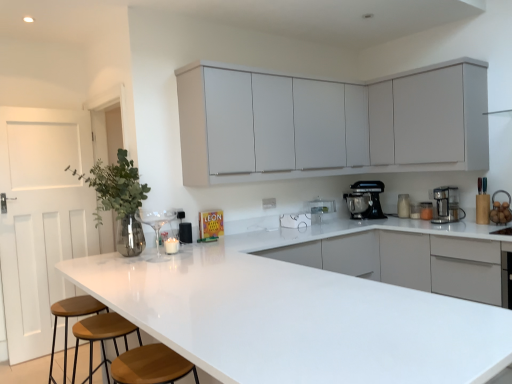
Measure the distance between white matte cabinet at upper right, the 2th cabinetry viewed from the left, and camera.

They are 10.33 feet apart.

This screenshot has height=384, width=512. What do you see at coordinates (297, 315) in the screenshot? I see `white glossy countertop at center` at bounding box center [297, 315].

In order to face brown leather stool at lower left, which is counted as the first bar stool, starting from the back, should I rotate leftwards or rightwards?

You should look left and rotate roughly 21.899 degrees.

Locate an element on the screen. Image resolution: width=512 pixels, height=384 pixels. white matte cabinet at upper center, which ranks as the 1th cabinetry in left-to-right order is located at coordinates (329, 123).

Locate an element on the screen. This screenshot has width=512, height=384. white glossy milk bottle at right, which appears as the first appliance when viewed from the left is located at coordinates (403, 206).

Describe the element at coordinates (403, 206) in the screenshot. I see `white glossy milk bottle at right, which is the 2th appliance in right-to-left order` at that location.

In order to click on silver metallic vase at left in this screenshot , I will do `click(120, 198)`.

Describe the element at coordinates (120, 198) in the screenshot. I see `silver metallic vase at left` at that location.

What do you see at coordinates (446, 206) in the screenshot?
I see `metallic silver coffee maker at right, which is the second home appliance from back to front` at bounding box center [446, 206].

At what (x,y) coordinates should I click in order to perform the action: click on white matte cabinet at upper right, the first cabinetry viewed from the right. Please return your answer as a coordinate pair (x, y). This screenshot has height=384, width=512. Looking at the image, I should click on (441, 116).

From the image's perspective, is metallic silver coffee maker at right, which is the second home appliance from back to front, under brown leather stool at lower left, which is counted as the first bar stool, starting from the back?

No, from the image's perspective, metallic silver coffee maker at right, which is the second home appliance from back to front, is not below brown leather stool at lower left, which is counted as the first bar stool, starting from the back.

Where is `bar stool that is the 2nd object located below the metallic silver coffee maker at right, the 1th home appliance when ordered from right to left (from the image's perspective)`? The width and height of the screenshot is (512, 384). bar stool that is the 2nd object located below the metallic silver coffee maker at right, the 1th home appliance when ordered from right to left (from the image's perspective) is located at coordinates (72, 316).

Consider the image. Considering the relative sizes of metallic silver coffee maker at right, the 1th home appliance when ordered from right to left, and brown leather stool at lower left, acting as the 2th bar stool starting from the front, in the image provided, is metallic silver coffee maker at right, the 1th home appliance when ordered from right to left, bigger than brown leather stool at lower left, acting as the 2th bar stool starting from the front,?

No, metallic silver coffee maker at right, the 1th home appliance when ordered from right to left, is not bigger than brown leather stool at lower left, acting as the 2th bar stool starting from the front.

Considering the relative sizes of metallic silver coffee maker at right, which is the second home appliance in left-to-right order, and brown leather stool at lower left, acting as the 2th bar stool starting from the front, in the image provided, is metallic silver coffee maker at right, which is the second home appliance in left-to-right order, wider than brown leather stool at lower left, acting as the 2th bar stool starting from the front,?

Incorrect, the width of metallic silver coffee maker at right, which is the second home appliance in left-to-right order, does not surpass that of brown leather stool at lower left, acting as the 2th bar stool starting from the front.

In terms of size, does white glossy countertop at center appear bigger or smaller than silver metallic vase at left?

white glossy countertop at center is bigger than silver metallic vase at left.

Does point (328, 334) come closer to viewer compared to point (117, 195)?

Yes, point (328, 334) is closer to viewer.

Between white glossy countertop at center and silver metallic vase at left, which one is positioned in front?

white glossy countertop at center is in front.

From the image's perspective, who appears lower, white glossy countertop at center or silver metallic vase at left?

white glossy countertop at center is shown below in the image.

Is white glossy milk bottle at right, the 2th appliance viewed from the front, completely or partially outside of brown wooden stool at lower left, the 1th bar stool positioned from the front?

Yes.

From a real-world perspective, is white glossy milk bottle at right, which is the 2th appliance in right-to-left order, positioned under brown wooden stool at lower left, positioned as the second bar stool in back-to-front order, based on gravity?

No, from a real-world perspective, white glossy milk bottle at right, which is the 2th appliance in right-to-left order, is not under brown wooden stool at lower left, positioned as the second bar stool in back-to-front order.

Is black matte stand mixer at right, arranged as the second home appliance when viewed from the front, taller or shorter than white glossy countertop at center?

Clearly, black matte stand mixer at right, arranged as the second home appliance when viewed from the front, is shorter compared to white glossy countertop at center.

Measure the distance between black matte stand mixer at right, which ranks as the second home appliance in right-to-left order, and white glossy countertop at center.

black matte stand mixer at right, which ranks as the second home appliance in right-to-left order, and white glossy countertop at center are 6.94 feet apart from each other.

Does black matte stand mixer at right, arranged as the second home appliance when viewed from the front, contain white glossy countertop at center?

No, white glossy countertop at center is not a part of black matte stand mixer at right, arranged as the second home appliance when viewed from the front.

Does black matte stand mixer at right, which is the 1th home appliance from back to front, turn towards white glossy countertop at center?

No, black matte stand mixer at right, which is the 1th home appliance from back to front, is not aimed at white glossy countertop at center.

From the image's perspective, which home appliance is the 2nd one above the white glossy milk bottle at right, which is the 2th appliance in right-to-left order? Please provide its 2D coordinates.

[(365, 200)]

Does black matte stand mixer at right, which ranks as the second home appliance in right-to-left order, have a lesser height compared to white glossy milk bottle at right, the first appliance in the back-to-front sequence?

In fact, black matte stand mixer at right, which ranks as the second home appliance in right-to-left order, may be taller than white glossy milk bottle at right, the first appliance in the back-to-front sequence.

Is point (366, 196) more distant than point (397, 203)?

No, it is in front of (397, 203).

In terms of width, does white glossy milk bottle at right, which appears as the first appliance when viewed from the left, look wider or thinner when compared to matte black coffee maker at right, the first appliance when ordered from right to left?

Considering their sizes, white glossy milk bottle at right, which appears as the first appliance when viewed from the left, looks broader than matte black coffee maker at right, the first appliance when ordered from right to left.

Is white glossy milk bottle at right, which appears as the first appliance when viewed from the left, taller than matte black coffee maker at right, which ranks as the first appliance in front-to-back order?

Yes, white glossy milk bottle at right, which appears as the first appliance when viewed from the left, is taller than matte black coffee maker at right, which ranks as the first appliance in front-to-back order.

From the image's perspective, is white glossy milk bottle at right, the 2th appliance viewed from the front, on matte black coffee maker at right, which ranks as the second appliance in back-to-front order?

Yes.

Is white glossy milk bottle at right, which is the 2th appliance in right-to-left order, beside matte black coffee maker at right, the first appliance when ordered from right to left?

No.

Considering the sizes of black matte stand mixer at right, placed as the 1th home appliance when sorted from left to right, and brown leather stool at lower left, which is counted as the first bar stool, starting from the back, in the image, is black matte stand mixer at right, placed as the 1th home appliance when sorted from left to right, taller or shorter than brown leather stool at lower left, which is counted as the first bar stool, starting from the back,?

Considering their sizes, black matte stand mixer at right, placed as the 1th home appliance when sorted from left to right, has less height than brown leather stool at lower left, which is counted as the first bar stool, starting from the back.

Is point (371, 212) positioned in front of point (67, 333)?

No.

From the image's perspective, which one is positioned higher, black matte stand mixer at right, which ranks as the second home appliance in right-to-left order, or brown leather stool at lower left, which is counted as the first bar stool, starting from the back?

black matte stand mixer at right, which ranks as the second home appliance in right-to-left order, appears higher in the image.

Identify the location of home appliance that is the 1st object located behind the brown leather stool at lower left, acting as the 2th bar stool starting from the front. (446, 206).

The width and height of the screenshot is (512, 384). I want to click on countertop on the right of silver metallic vase at left, so click(297, 315).

Looking at the image, which one is located closer to matte black coffee maker at right, which ranks as the 2th appliance in left-to-right order, metallic silver coffee maker at right, the 1th home appliance when ordered from right to left, or white matte cabinet at upper center, which ranks as the 1th cabinetry in left-to-right order?

metallic silver coffee maker at right, the 1th home appliance when ordered from right to left.

Considering their positions, is silver metallic vase at left positioned further to black matte stand mixer at right, placed as the 1th home appliance when sorted from left to right, than metallic silver coffee maker at right, which is the second home appliance in left-to-right order?

Among the two, silver metallic vase at left is located further to black matte stand mixer at right, placed as the 1th home appliance when sorted from left to right.

Considering their positions, is white glossy countertop at center positioned further to brown leather stool at lower left, which is counted as the first bar stool, starting from the back, than white matte cabinet at upper center, which ranks as the 1th cabinetry in left-to-right order?

white matte cabinet at upper center, which ranks as the 1th cabinetry in left-to-right order, is further to brown leather stool at lower left, which is counted as the first bar stool, starting from the back.

Estimate the real-world distances between objects in this image. Which object is closer to white glossy countertop at center, brown wooden stool at lower left, the 1th bar stool positioned from the front, or black matte stand mixer at right, placed as the 1th home appliance when sorted from left to right?

Among the two, brown wooden stool at lower left, the 1th bar stool positioned from the front, is located nearer to white glossy countertop at center.

Based on their spatial positions, is white matte cabinet at upper right, the 2th cabinetry viewed from the left, or white glossy milk bottle at right, which appears as the first appliance when viewed from the left, further from metallic silver coffee maker at right, which is the second home appliance from back to front?

white matte cabinet at upper right, the 2th cabinetry viewed from the left, is further to metallic silver coffee maker at right, which is the second home appliance from back to front.

Based on their spatial positions, is brown wooden stool at lower left, positioned as the second bar stool in back-to-front order, or white matte cabinet at upper center, marked as the second cabinetry in a right-to-left arrangement, closer to matte black coffee maker at right, which ranks as the first appliance in front-to-back order?

The object closer to matte black coffee maker at right, which ranks as the first appliance in front-to-back order, is white matte cabinet at upper center, marked as the second cabinetry in a right-to-left arrangement.

Based on their spatial positions, is silver metallic vase at left or white glossy milk bottle at right, which appears as the first appliance when viewed from the left, further from white matte cabinet at upper center, marked as the second cabinetry in a right-to-left arrangement?

silver metallic vase at left.

When comparing their distances from silver metallic vase at left, does matte black coffee maker at right, which ranks as the second appliance in back-to-front order, or white matte cabinet at upper right, the 2th cabinetry viewed from the left, seem further?

Among the two, matte black coffee maker at right, which ranks as the second appliance in back-to-front order, is located further to silver metallic vase at left.

You are a GUI agent. You are given a task and a screenshot of the screen. Output one action in this format:
    pyautogui.click(x=<x>, y=<y>)
    Task: Click on the bar stool situated between brown leather stool at lower left, which is counted as the first bar stool, starting from the back, and white matte cabinet at upper right, the 2th cabinetry viewed from the left, from left to right
    The width and height of the screenshot is (512, 384).
    Given the screenshot: What is the action you would take?
    pyautogui.click(x=102, y=337)

Where is `appliance between white matte cabinet at upper right, the 2th cabinetry viewed from the left, and matte black coffee maker at right, which ranks as the first appliance in front-to-back order, vertically`? appliance between white matte cabinet at upper right, the 2th cabinetry viewed from the left, and matte black coffee maker at right, which ranks as the first appliance in front-to-back order, vertically is located at coordinates (403, 206).

The image size is (512, 384). Identify the location of countertop between white matte cabinet at upper center, which ranks as the 1th cabinetry in left-to-right order, and white glossy milk bottle at right, which appears as the first appliance when viewed from the left, in the front-back direction. (297, 315).

At what (x,y) coordinates should I click in order to perform the action: click on home appliance between white matte cabinet at upper right, the first cabinetry viewed from the right, and metallic silver coffee maker at right, which is the second home appliance in left-to-right order, vertically. Please return your answer as a coordinate pair (x, y). This screenshot has width=512, height=384. Looking at the image, I should click on (365, 200).